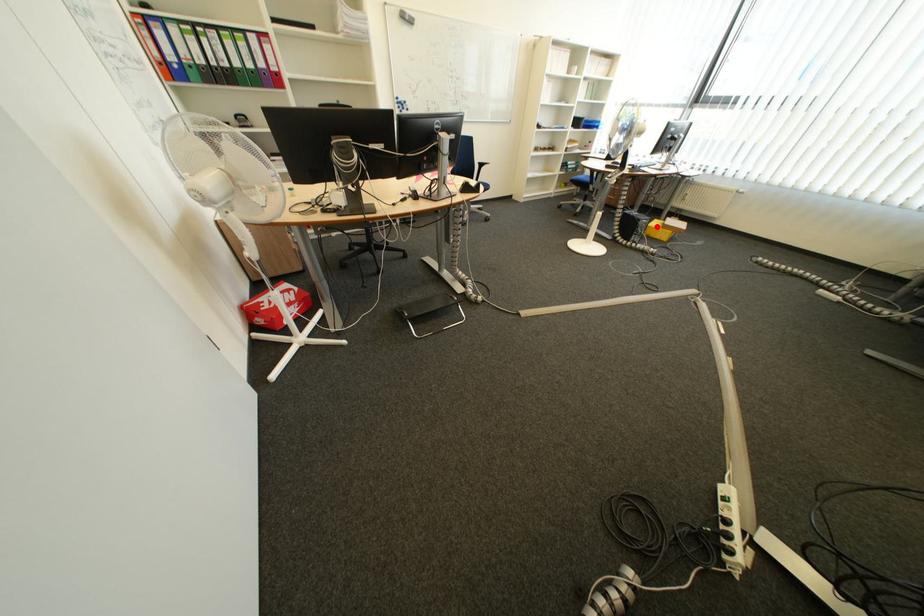
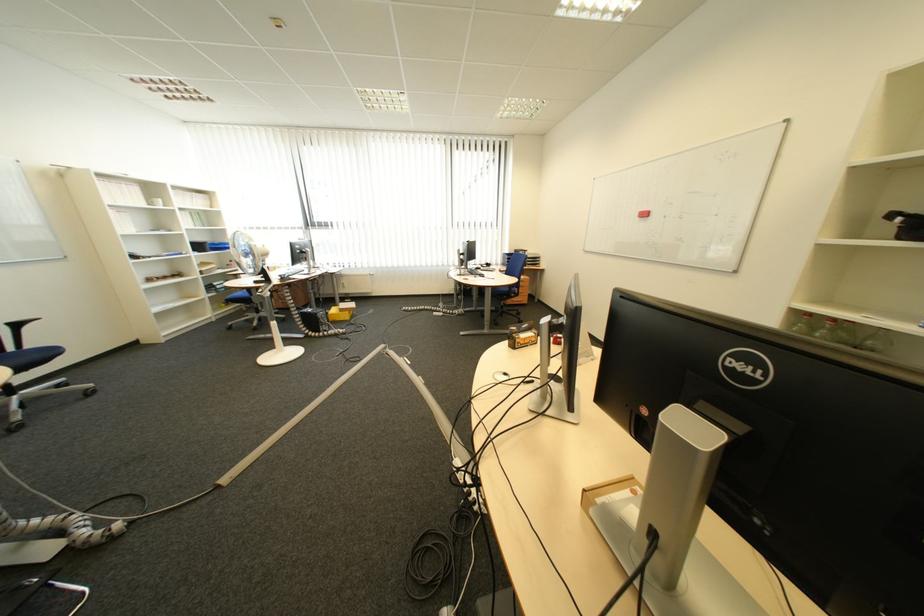
Question: I am providing you with two images of the same scene from different viewpoints. Image1 has a red point marked. In image2, the corresponding 3D location appears at what relative position? Reply with the corresponding letter.

Choices:
 (A) Closer
 (B) Farther

Answer: (A)